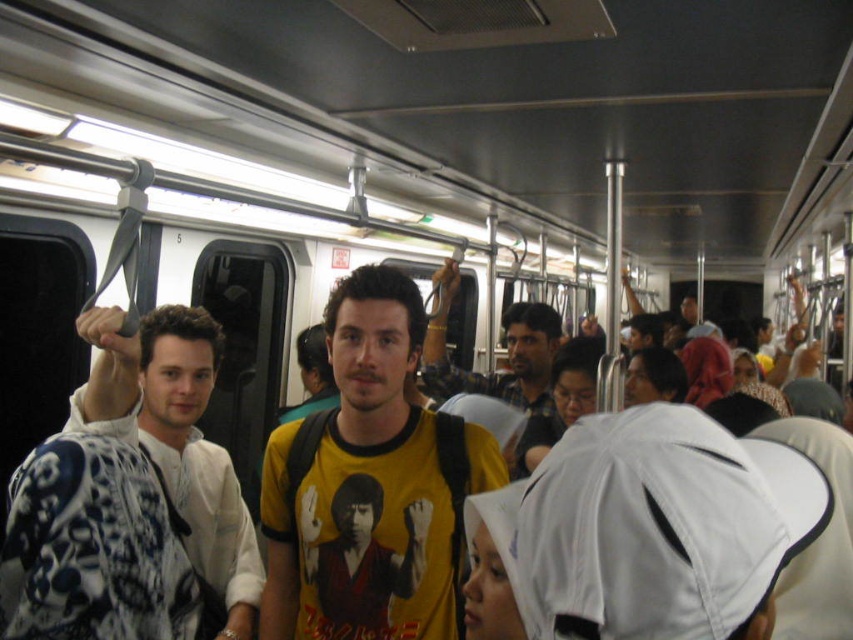
You are standing in the subway train and want to know which of the two points, point (x=370, y=579) or point (x=543, y=355), is closer to you. Can you determine this based on the scene?

Point (x=370, y=579) is closer to the viewer than point (x=543, y=355).